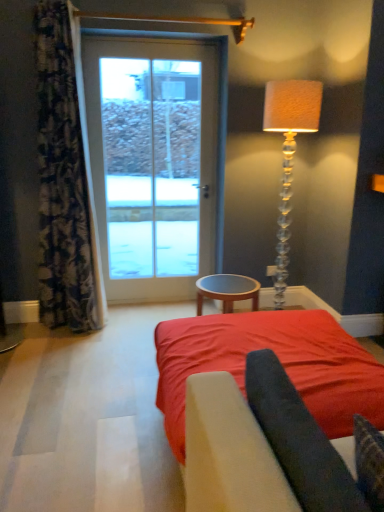
You are a GUI agent. You are given a task and a screenshot of the screen. Output one action in this format:
    pyautogui.click(x=<x>, y=<y>)
    Task: Click on the vacant region above brown wooden table at center (from a real-world perspective)
    
    Given the screenshot: What is the action you would take?
    pyautogui.click(x=232, y=281)